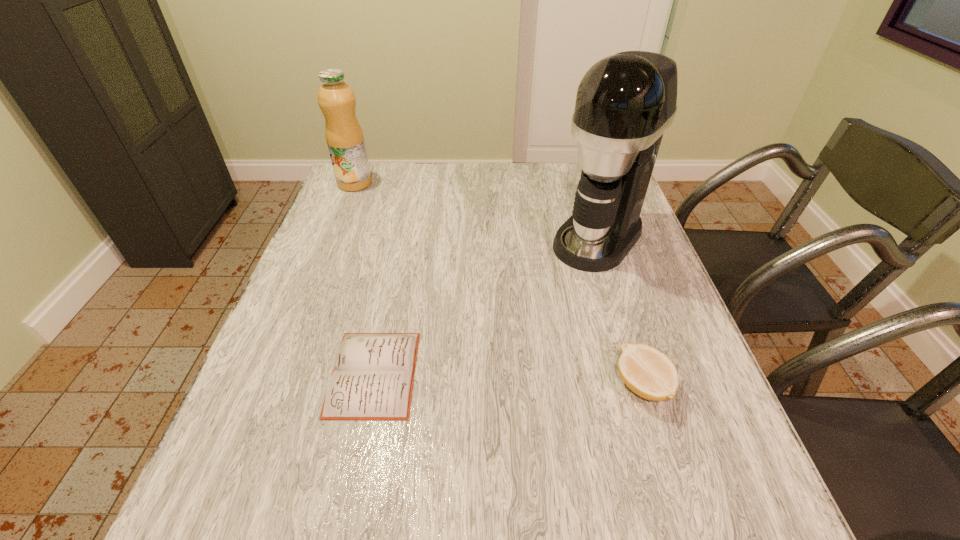
The width and height of the screenshot is (960, 540). In order to click on free space on the desktop that is between the second object from left to right and the lemon and is positioned place cup under the spout of the third nearest object in this screenshot , I will do `click(474, 378)`.

Find the location of `free space on the desktop that is between the second object from left to right and the second shortest object and is positioned on the front label of the farthest object`. free space on the desktop that is between the second object from left to right and the second shortest object and is positioned on the front label of the farthest object is located at coordinates (517, 380).